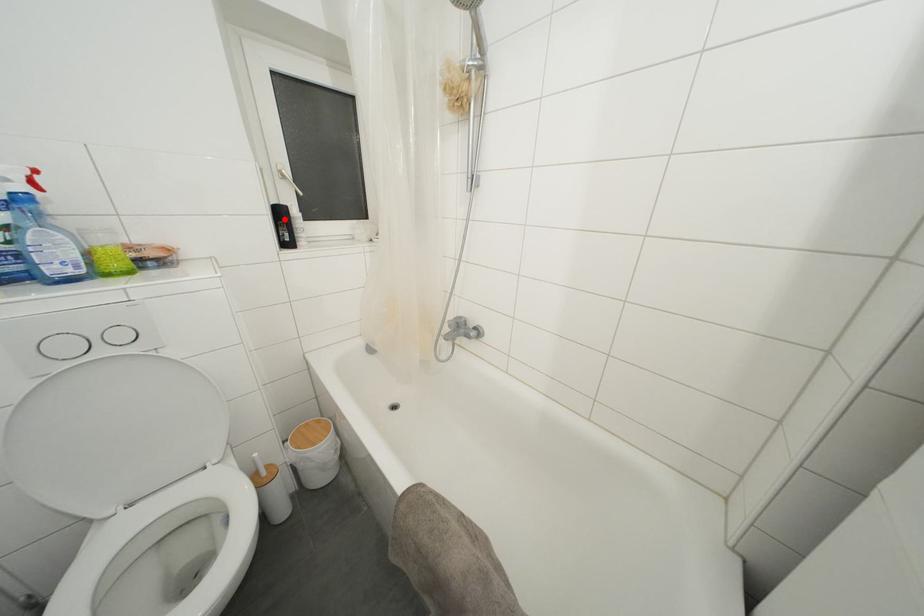
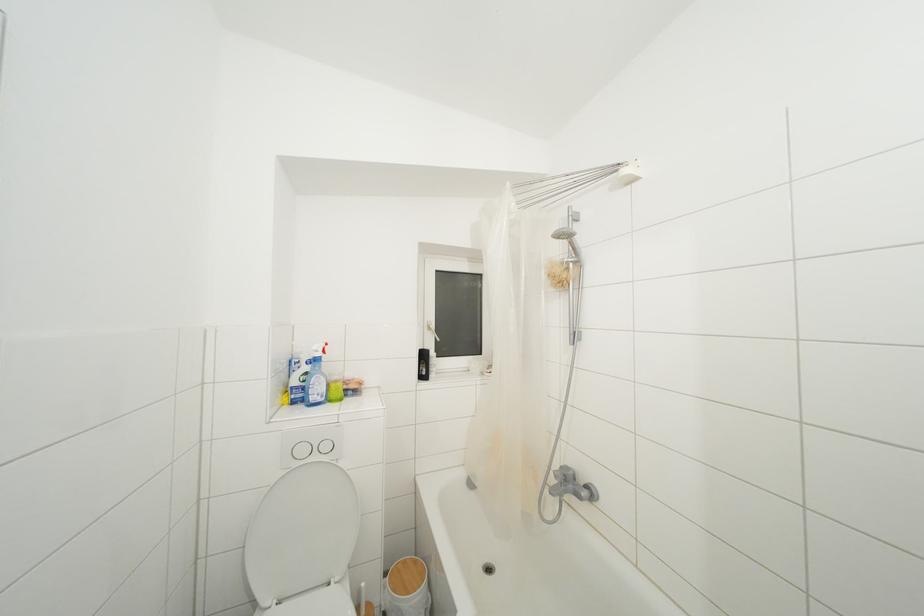
Locate, in the second image, the point that corresponds to the highlighted location in the first image.

(428, 361)